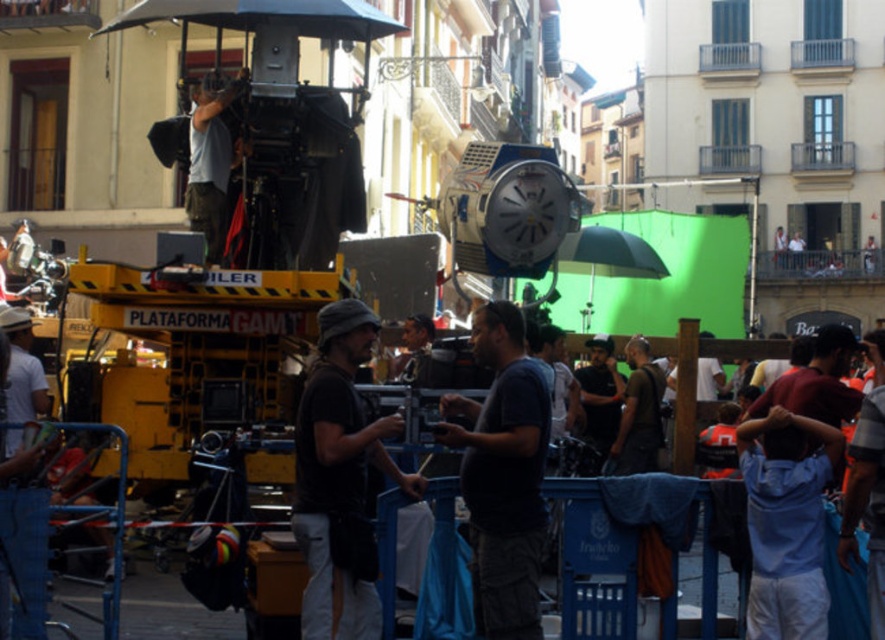
Question: Is black fabric bag at center above green matte umbrella at center?

Choices:
 (A) no
 (B) yes

Answer: (A)

Question: Does black fabric bag at center appear over green matte umbrella at center?

Choices:
 (A) no
 (B) yes

Answer: (A)

Question: Which point appears closest to the camera in this image?

Choices:
 (A) (658, 273)
 (B) (372, 429)

Answer: (B)

Question: Is black fabric bag at center below green matte umbrella at center?

Choices:
 (A) no
 (B) yes

Answer: (B)

Question: Which point is farther to the camera?

Choices:
 (A) black fabric bag at center
 (B) green matte umbrella at center

Answer: (B)